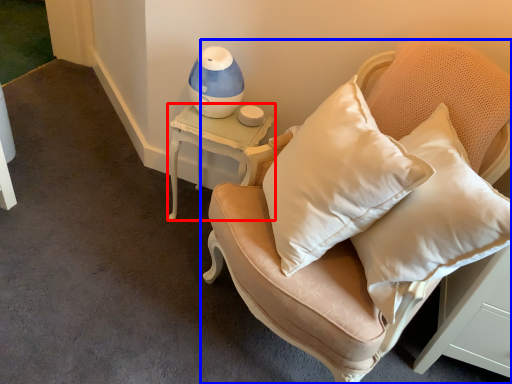
Question: Which of the following is the farthest to the observer, table (highlighted by a red box) or furniture (highlighted by a blue box)?

Choices:
 (A) table
 (B) furniture

Answer: (A)